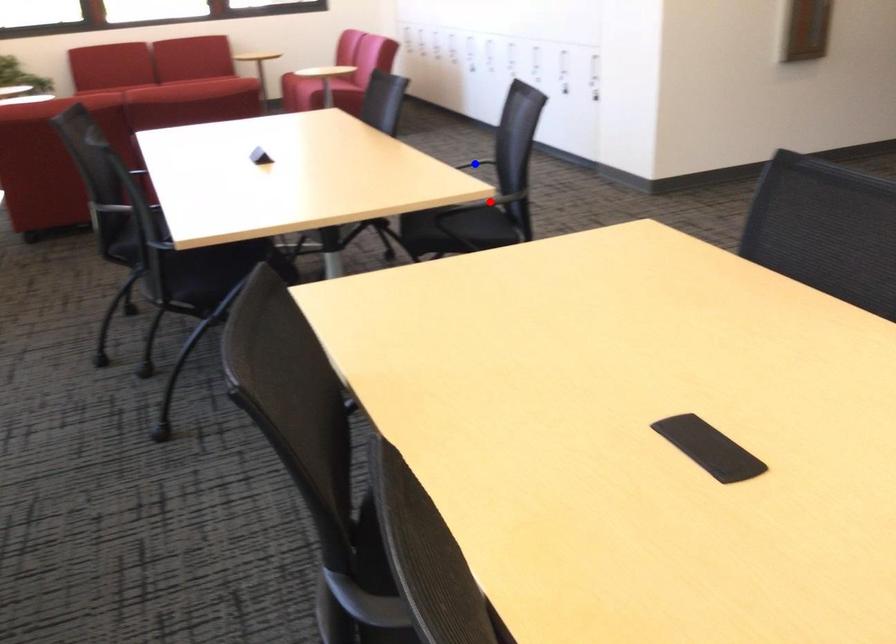
Question: In the image, two points are highlighted. Which point is nearer to the camera? Reply with the corresponding letter.

Choices:
 (A) blue point
 (B) red point

Answer: (B)